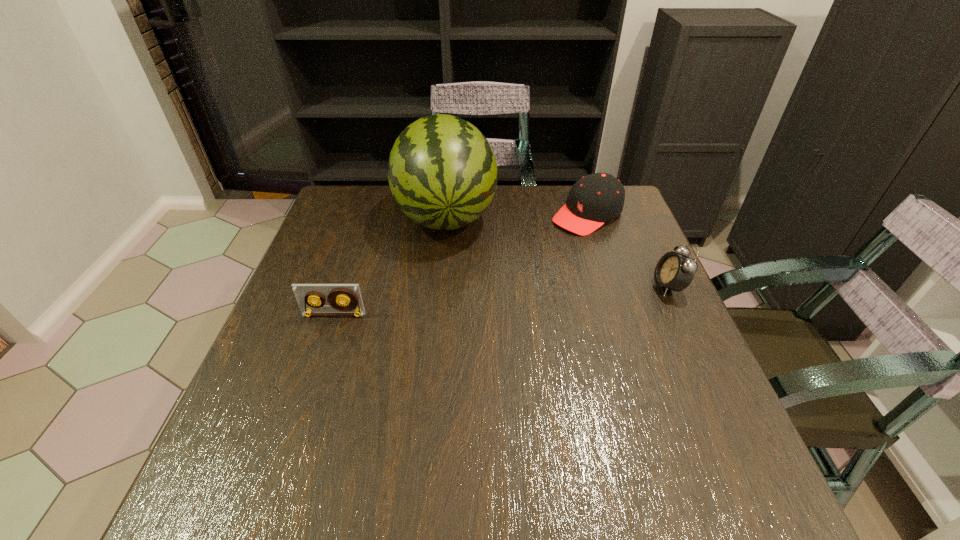
Image resolution: width=960 pixels, height=540 pixels. In order to click on unoccupied area between the shortest object and the third farthest object in this screenshot , I will do `click(501, 301)`.

I want to click on unoccupied area between the cap and the watermelon, so coord(516,215).

At what (x,y) coordinates should I click in order to perform the action: click on empty space that is in between the leftmost object and the alarm clock. Please return your answer as a coordinate pair (x, y). This screenshot has width=960, height=540. Looking at the image, I should click on (501, 301).

You are a GUI agent. You are given a task and a screenshot of the screen. Output one action in this format:
    pyautogui.click(x=<x>, y=<y>)
    Task: Click on the free space between the tallest object and the cap
    The height and width of the screenshot is (540, 960).
    Given the screenshot: What is the action you would take?
    pyautogui.click(x=516, y=215)

Identify the location of unoccupied area between the leftmost object and the watermelon. This screenshot has height=540, width=960. (390, 265).

The height and width of the screenshot is (540, 960). Identify the location of free space between the cap and the second nearest object. pos(628,251).

Locate an element on the screen. The height and width of the screenshot is (540, 960). vacant point located between the tallest object and the alarm clock is located at coordinates (557, 251).

The image size is (960, 540). Identify the location of object that is the closest to the alarm clock. point(597,198).

Identify which object is the third nearest to the tallest object. Please provide its 2D coordinates. Your answer should be formatted as a tuple, i.e. [(x, y)], where the tuple contains the x and y coordinates of a point satisfying the conditions above.

[(674, 271)]

The image size is (960, 540). Find the location of `free space that satisfies the following two spatial constraints: 1. on the front side of the second nearest object; 2. on the face of the cap`. free space that satisfies the following two spatial constraints: 1. on the front side of the second nearest object; 2. on the face of the cap is located at coordinates (610, 286).